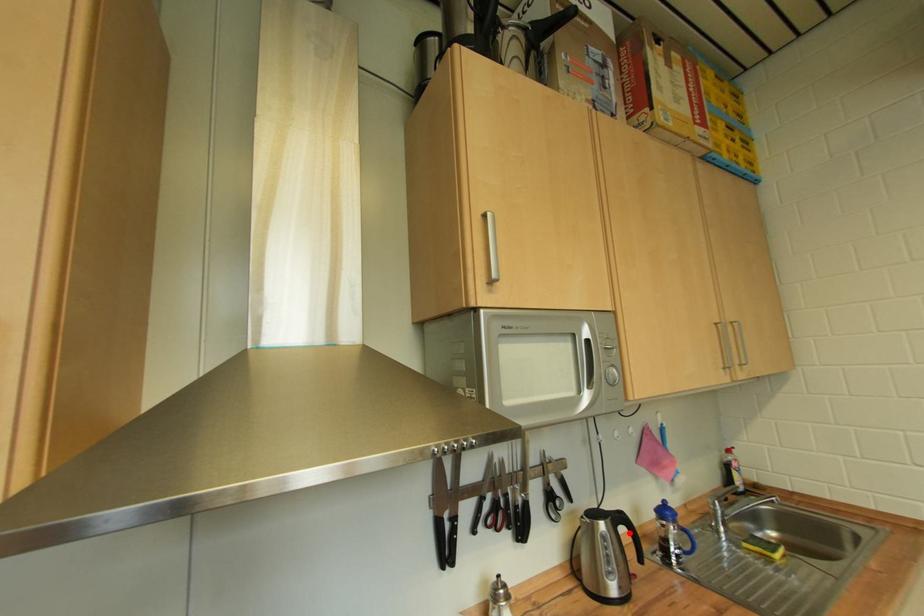
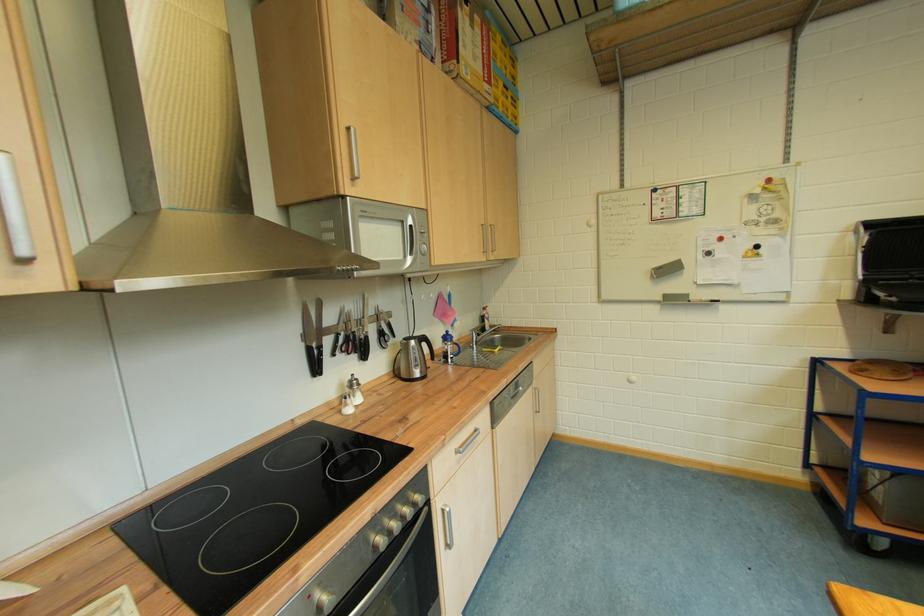
Locate, in the second image, the point that corresponds to the highlighted location in the first image.

(432, 347)